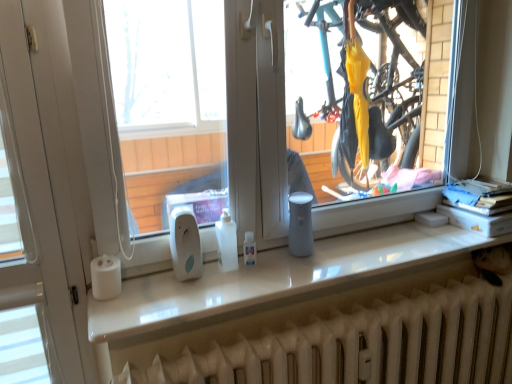
The width and height of the screenshot is (512, 384). I want to click on unoccupied area in front of white matte paper towel at left, so click(x=110, y=316).